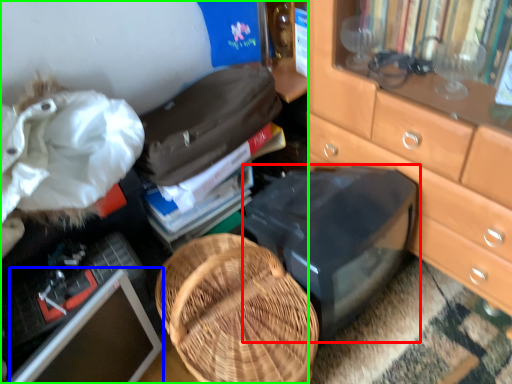
Question: Which object is positioned closest to desktop (highlighted by a red box)? Select from computer monitor (highlighted by a blue box) and desk (highlighted by a green box).

Choices:
 (A) computer monitor
 (B) desk

Answer: (B)